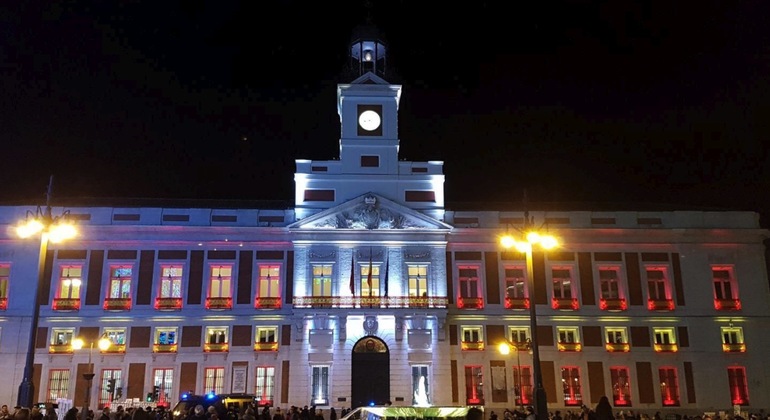
This screenshot has height=420, width=770. I want to click on clock, so click(370, 124).